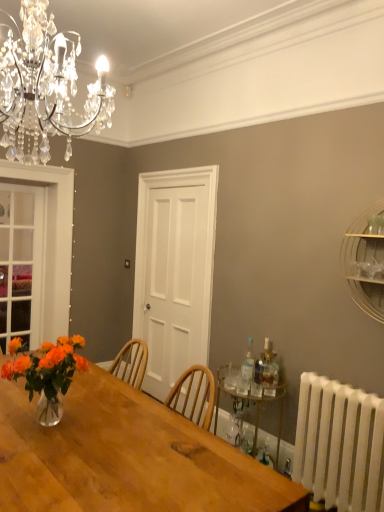
Question: Looking at the image, does white wooden door at center seem bigger or smaller compared to translucent glass vase at table left?

Choices:
 (A) big
 (B) small

Answer: (A)

Question: Would you say white wooden door at center is to the left or to the right of translucent glass vase at table left in the picture?

Choices:
 (A) left
 (B) right

Answer: (B)

Question: Which of these objects is positioned farthest from the clear glass door at left?

Choices:
 (A) white plastic radiator at lower right
 (B) metallic gold shelf at upper right, which is the 1th shelf in right-to-left order
 (C) white wooden door at center
 (D) translucent glass vase at table left
 (E) translucent glass bottle at right, marked as the 2th bottle in a left-to-right arrangement

Answer: (B)

Question: Considering the real-world distances, which object is farthest from the white wooden door at center?

Choices:
 (A) clear glass door at left
 (B) gold metallic bar cart at lower right, placed as the 2th shelf when sorted from top to bottom
 (C) metallic gold shelf at upper right, which is the first shelf from front to back
 (D) white plastic radiator at lower right
 (E) translucent glass bottle at right, arranged as the second bottle when viewed from the back

Answer: (C)